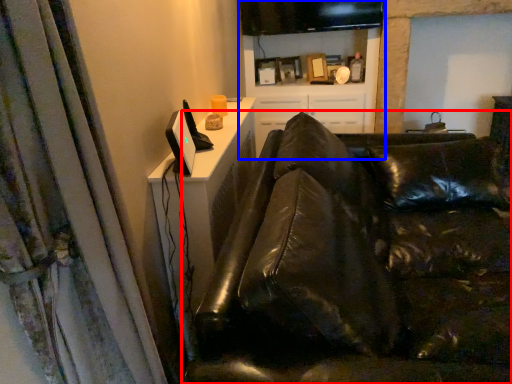
Question: Which object is closer to the camera taking this photo, studio couch (highlighted by a red box) or entertainment center (highlighted by a blue box)?

Choices:
 (A) studio couch
 (B) entertainment center

Answer: (A)